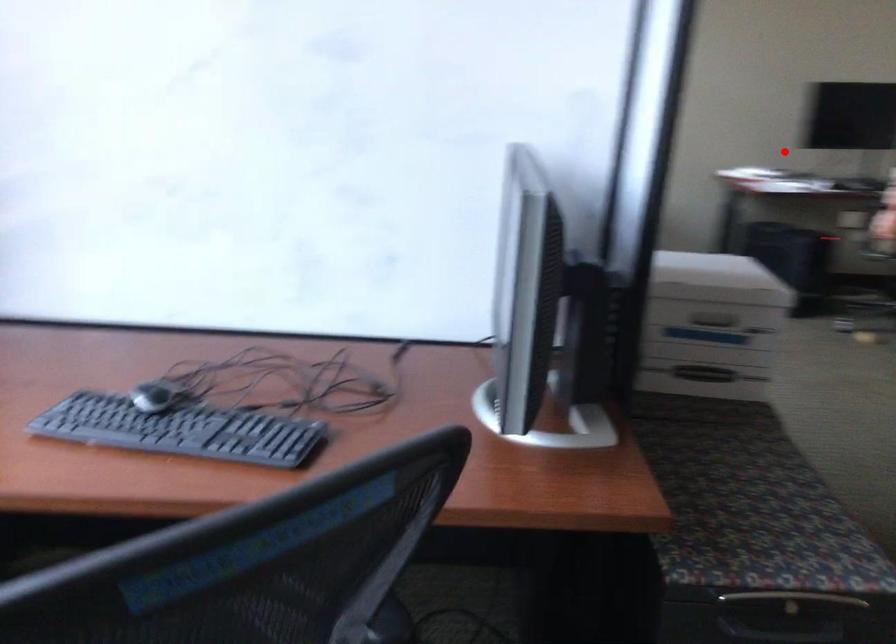
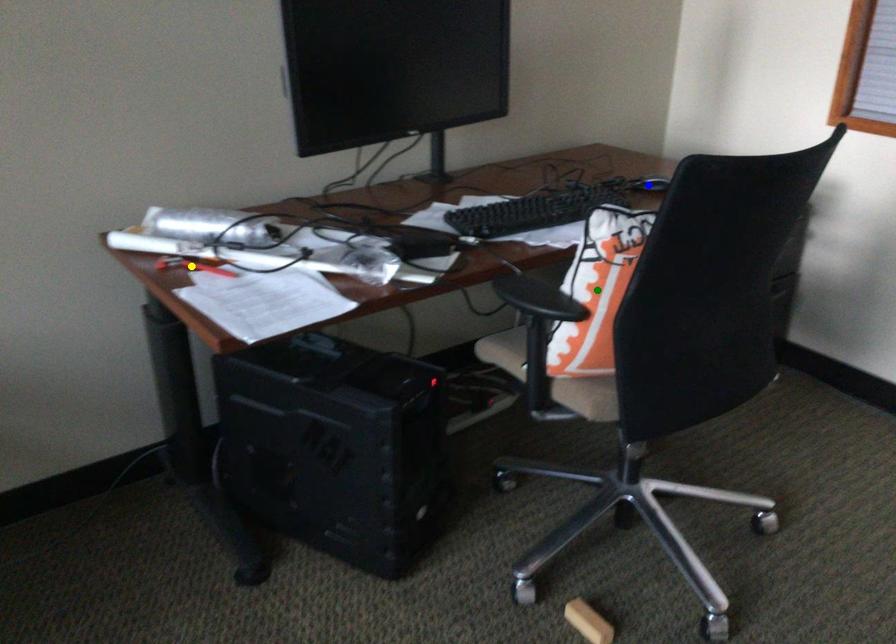
Question: I am providing you with two images of the same scene from different viewpoints. A red point is marked on the first image. You are given multiple points on the second image. Can you choose the point in image 2 that corresponds to the point in image 1?

Choices:
 (A) green point
 (B) yellow point
 (C) blue point

Answer: (B)